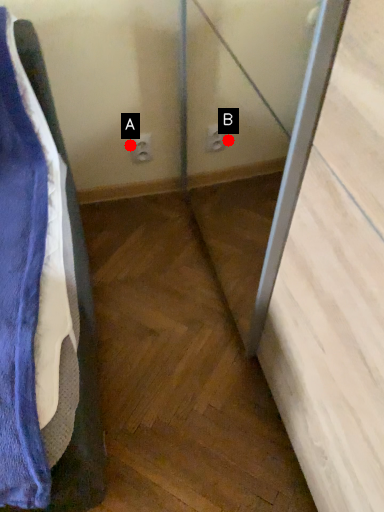
Question: Two points are circled on the image, labeled by A and B beside each circle. Which point is farther from the camera taking this photo?

Choices:
 (A) A is further
 (B) B is further

Answer: (B)